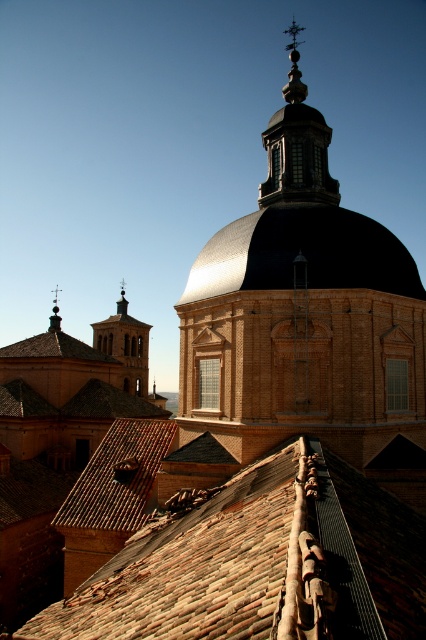
Looking at this image, you are standing at the base of the domed structure and looking towards the tiled roof. There is a specific point marked at coordinates [259,563]. What object is located at this point?

The point at [259,563] is where the brown clay tiles at center are located.

You are an architect inspecting a building with two domes. You notice the brick textured dome at center and the shiny metallic dome at center. Which dome is located above the other?

The brick textured dome at center is positioned over the shiny metallic dome at center, meaning the brick dome is above the metallic one.

You are an architect reviewing the design of the building. The brown clay tiles at center are positioned at coordinates. Do they align with the proposed decorative elements on the roof edge?

The brown clay tiles at center are located at point (259, 563), which means they are positioned away from the roof edge where the decorative elements are placed. Therefore, they do not align with the proposed decorative elements on the roof edge.